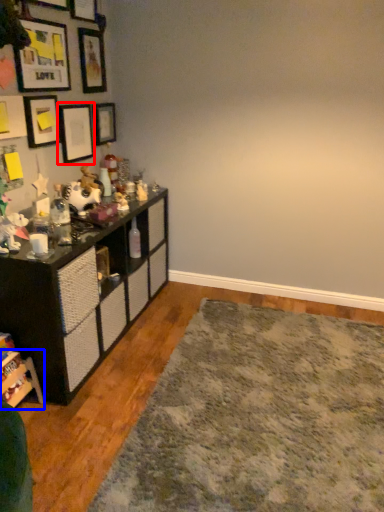
Question: Which of the following is the farthest to the observer, picture frame (highlighted by a red box) or shelf (highlighted by a blue box)?

Choices:
 (A) picture frame
 (B) shelf

Answer: (A)